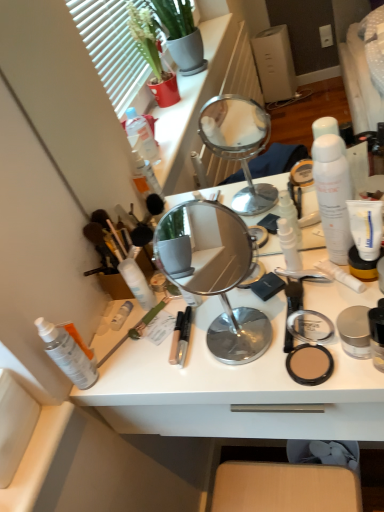
You are a GUI agent. You are given a task and a screenshot of the screen. Output one action in this format:
    pyautogui.click(x=<x>, y=<y>)
    Task: Click on the empty space that is in between green matte brush at center and white matte spray can at upper right, acting as the first toiletry starting from the right
    This screenshot has width=384, height=512.
    Given the screenshot: What is the action you would take?
    pyautogui.click(x=214, y=308)